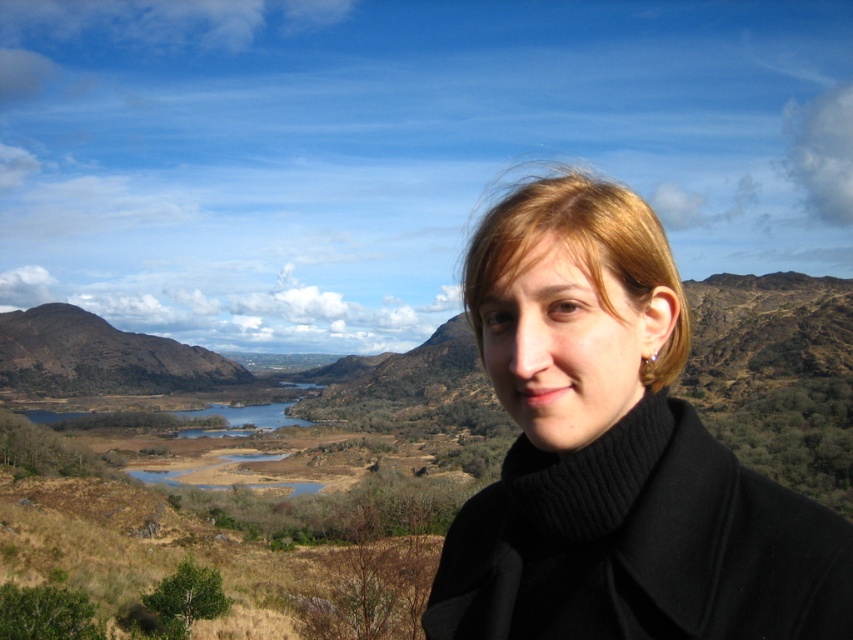
What do you see at coordinates (614, 452) in the screenshot?
I see `black woolen coat at right` at bounding box center [614, 452].

Is black woolen coat at right thinner than brown textured mountain at left?

Correct, black woolen coat at right's width is less than brown textured mountain at left's.

Image resolution: width=853 pixels, height=640 pixels. Find the location of `black woolen coat at right`. black woolen coat at right is located at coordinates (614, 452).